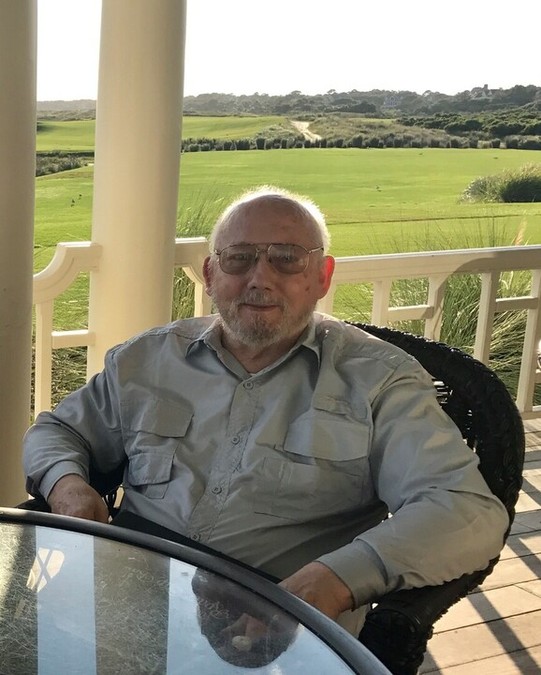
The image size is (541, 675). I want to click on left armrest, so click(425, 626).